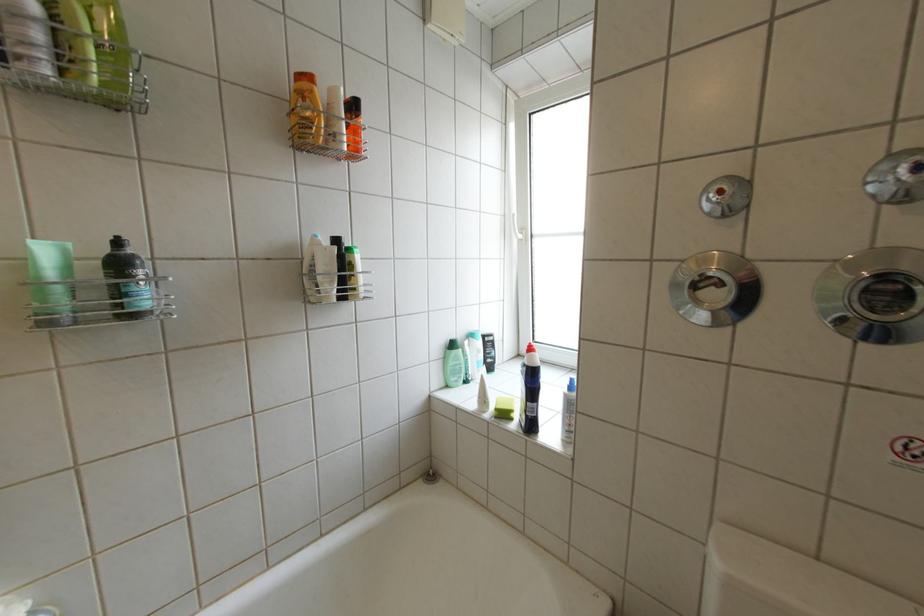
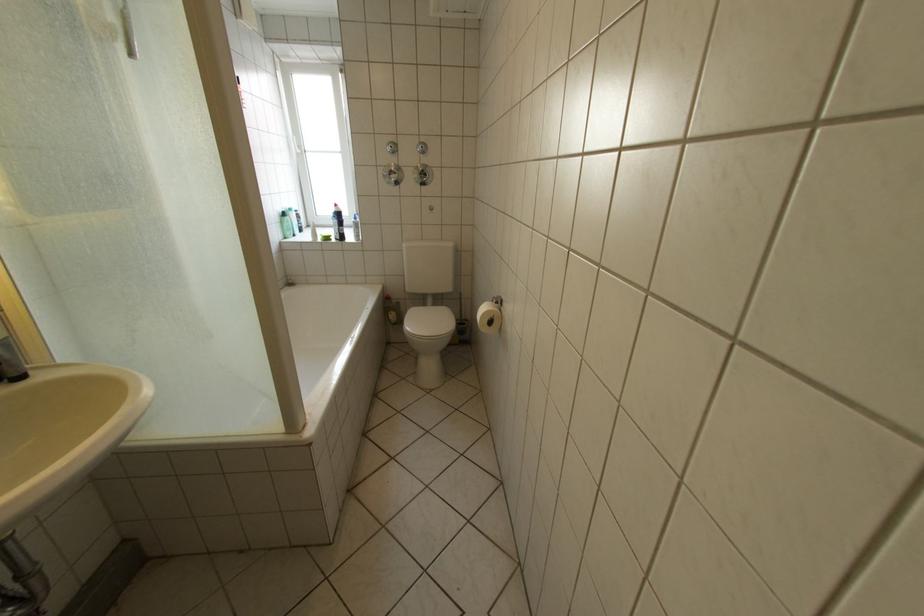
Locate, in the second image, the point that corresponds to point (676, 273) in the first image.

(393, 171)